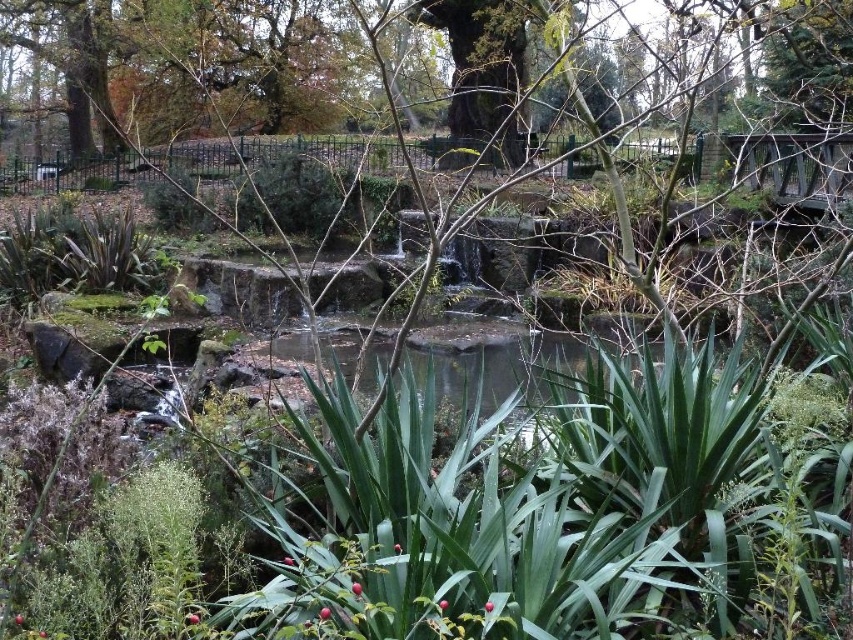
Question: Which point is closer to the camera?

Choices:
 (A) green mossy pond at center
 (B) green mossy tree at upper center

Answer: (B)

Question: Is green mossy tree at upper center behind green mossy pond at center?

Choices:
 (A) yes
 (B) no

Answer: (B)

Question: Is green mossy tree at upper center smaller than green mossy pond at center?

Choices:
 (A) no
 (B) yes

Answer: (A)

Question: Is green mossy tree at upper center in front of green mossy pond at center?

Choices:
 (A) no
 (B) yes

Answer: (B)